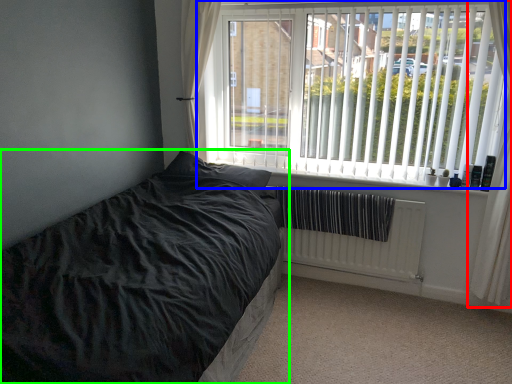
Question: Which is nearer to the curtain (highlighted by a red box)? window (highlighted by a blue box) or bed (highlighted by a green box).

Choices:
 (A) window
 (B) bed

Answer: (A)